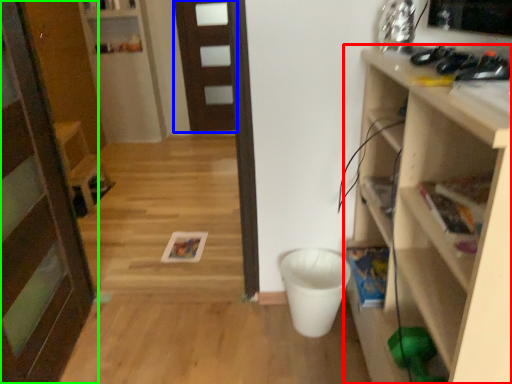
Question: Which is nearer to the shelf (highlighted by a red box)? door (highlighted by a blue box) or door (highlighted by a green box).

Choices:
 (A) door
 (B) door

Answer: (B)